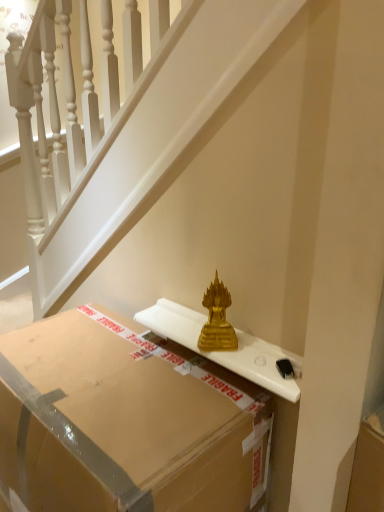
Question: Does gold glass sculpture at center have a larger size compared to gold metallic statue at center?

Choices:
 (A) yes
 (B) no

Answer: (B)

Question: Is gold glass sculpture at center shorter than gold metallic statue at center?

Choices:
 (A) yes
 (B) no

Answer: (A)

Question: Is gold glass sculpture at center further to the viewer compared to gold metallic statue at center?

Choices:
 (A) yes
 (B) no

Answer: (A)

Question: Is the position of gold glass sculpture at center less distant than that of gold metallic statue at center?

Choices:
 (A) no
 (B) yes

Answer: (A)

Question: Would you say gold glass sculpture at center is a long distance from gold metallic statue at center?

Choices:
 (A) yes
 (B) no

Answer: (B)

Question: Considering the relative sizes of gold glass sculpture at center and gold metallic statue at center in the image provided, is gold glass sculpture at center smaller than gold metallic statue at center?

Choices:
 (A) yes
 (B) no

Answer: (A)

Question: From the image's perspective, would you say matte cardboard box at center is positioned over gold metallic statue at center?

Choices:
 (A) yes
 (B) no

Answer: (B)

Question: Is matte cardboard box at center positioned in front of gold metallic statue at center?

Choices:
 (A) yes
 (B) no

Answer: (A)

Question: Does matte cardboard box at center have a lesser height compared to gold metallic statue at center?

Choices:
 (A) yes
 (B) no

Answer: (A)

Question: Are matte cardboard box at center and gold metallic statue at center located far from each other?

Choices:
 (A) yes
 (B) no

Answer: (B)

Question: Considering the relative positions of matte cardboard box at center and gold metallic statue at center in the image provided, is matte cardboard box at center to the right of gold metallic statue at center from the viewer's perspective?

Choices:
 (A) yes
 (B) no

Answer: (B)

Question: Could you tell me if matte cardboard box at center is turned towards gold metallic statue at center?

Choices:
 (A) yes
 (B) no

Answer: (B)

Question: Is gold metallic statue at center located outside gold glass sculpture at center?

Choices:
 (A) no
 (B) yes

Answer: (B)